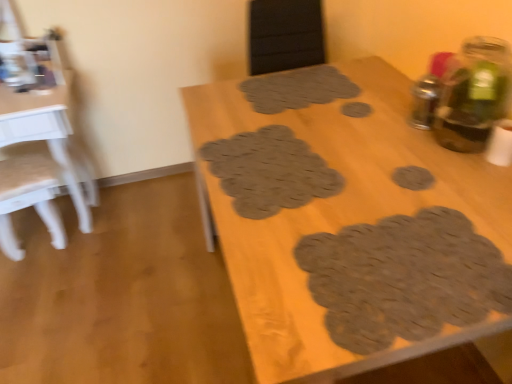
Find the location of a particular element. Image resolution: width=512 pixels, height=384 pixels. vacant point to the left of brown textured mat at bottom right, marked as the fifth footprint in a top-to-bottom arrangement is located at coordinates (275, 281).